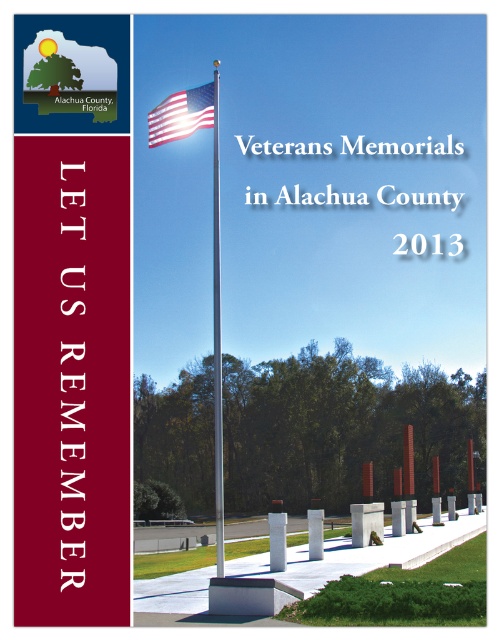
Question: Does polished metal flag pole at center have a lesser width compared to white concrete pillar at center?

Choices:
 (A) yes
 (B) no

Answer: (B)

Question: Is polished metal flag pole at center smaller than white polished stone pillar at center?

Choices:
 (A) yes
 (B) no

Answer: (B)

Question: Which object is the farthest from the white polished stone pillar at center?

Choices:
 (A) white concrete pillar at center
 (B) polished metal flag pole at center

Answer: (B)

Question: Which point is closer to the camera?

Choices:
 (A) white concrete pillar at center
 (B) polished metal flag pole at center

Answer: (B)

Question: Is american flag at center below white concrete pillar at center?

Choices:
 (A) no
 (B) yes

Answer: (A)

Question: Among these objects, which one is nearest to the camera?

Choices:
 (A) white polished stone pillar at center
 (B) white concrete pillar at center
 (C) polished metal flag pole at center
 (D) american flag at center

Answer: (C)